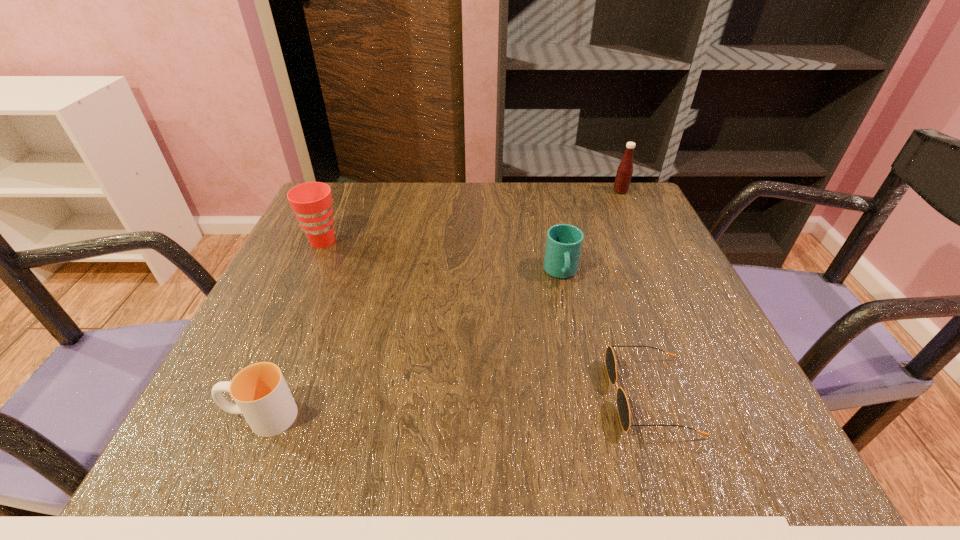
This screenshot has width=960, height=540. Find the location of `the rightmost object`. the rightmost object is located at coordinates (624, 172).

Identify the location of the farthest object. click(624, 172).

You are a GUI agent. You are given a task and a screenshot of the screen. Output one action in this format:
    pyautogui.click(x=<x>, y=<y>)
    Task: Click on the fourth nearest object
    Image resolution: width=960 pixels, height=540 pixels.
    Given the screenshot: What is the action you would take?
    pyautogui.click(x=311, y=202)

Locate an element on the screen. The image size is (960, 540). the tallest cup is located at coordinates (311, 202).

Identify the location of the rightmost cup. (564, 242).

This screenshot has height=540, width=960. I want to click on the second farthest cup, so click(x=564, y=242).

Find the location of `the nearest cup`. the nearest cup is located at coordinates (261, 394).

You are a GUI agent. You are given a task and a screenshot of the screen. Output one action in this format:
    pyautogui.click(x=<x>, y=<y>)
    Task: Click on the shortest object
    
    Given the screenshot: What is the action you would take?
    pyautogui.click(x=623, y=408)

I want to click on free point located on the left of the farthest object, so click(541, 191).

The image size is (960, 540). What are the coordinates of `free space located 0.080m on the front of the fourth nearest object` in the screenshot? It's located at click(306, 277).